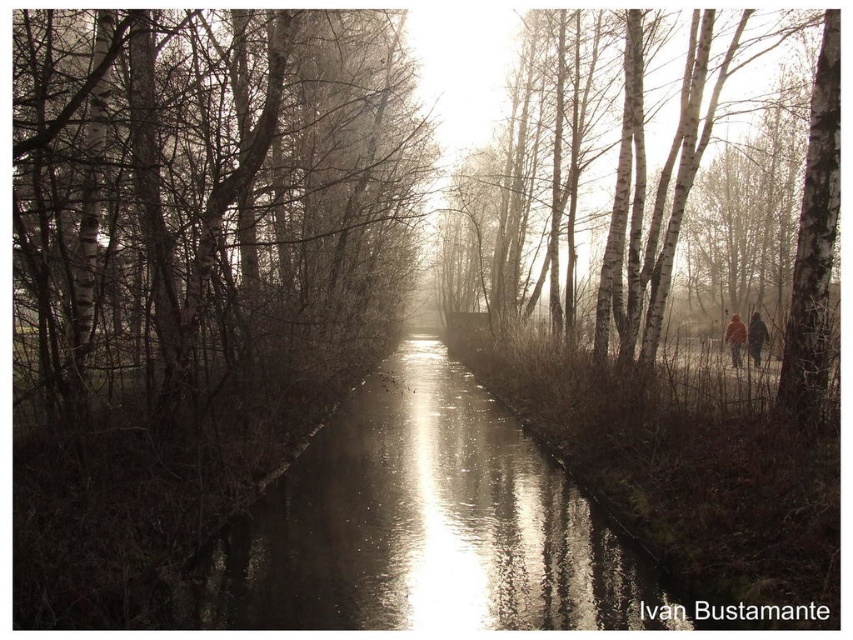
Question: Does brown leather jacket at right have a lesser width compared to dark brown leather jacket at right?

Choices:
 (A) yes
 (B) no

Answer: (B)

Question: Which point is closer to the camera?

Choices:
 (A) glistening reflective water at center
 (B) smooth bark trees at center

Answer: (B)

Question: Can you confirm if smooth bark trees at center is bigger than glistening reflective water at center?

Choices:
 (A) no
 (B) yes

Answer: (B)

Question: Which of the following is the closest to the observer?

Choices:
 (A) (735, 340)
 (B) (619, 248)
 (C) (751, 324)
 (D) (369, 612)

Answer: (D)

Question: Is smooth bark trees at center in front of glistening reflective water at center?

Choices:
 (A) no
 (B) yes

Answer: (B)

Question: Which of the following is the closest to the observer?

Choices:
 (A) smooth bark trees at center
 (B) glistening reflective water at center
 (C) dark brown leather jacket at right

Answer: (A)